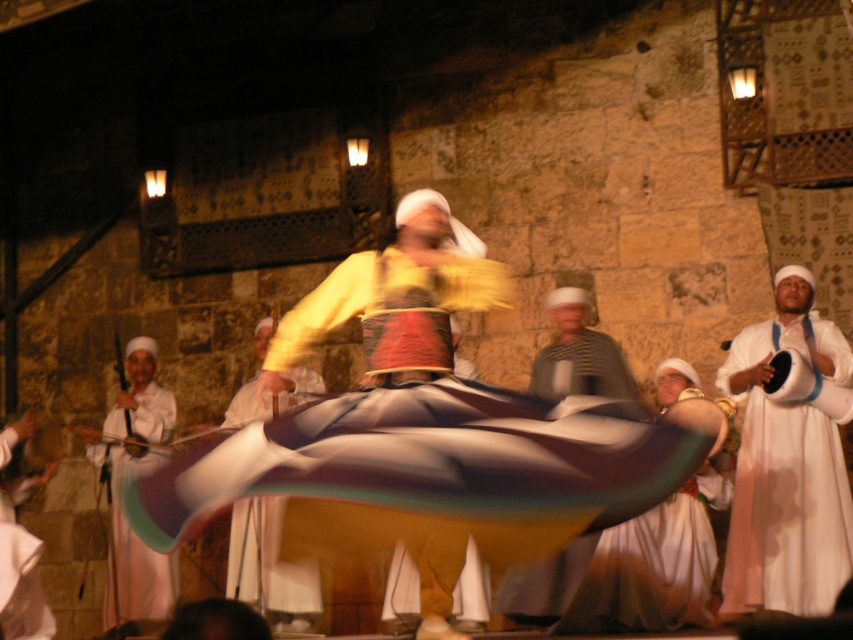
Does white cotton dress at center appear on the left side of striped fabric headscarf at center?

Indeed, white cotton dress at center is positioned on the left side of striped fabric headscarf at center.

Measure the distance from white cotton dress at center to striped fabric headscarf at center.

They are 6.16 meters apart.

Locate an element on the screen. white cotton dress at center is located at coordinates (268, 566).

Does white cotton robe at left have a smaller size compared to white cotton dress at lower left?

Yes.

The image size is (853, 640). What do you see at coordinates (123, 481) in the screenshot? I see `white cotton robe at left` at bounding box center [123, 481].

At what (x,y) coordinates should I click in order to perform the action: click on white cotton robe at left. Please return your answer as a coordinate pair (x, y). The image size is (853, 640). Looking at the image, I should click on (123, 481).

Which is behind, point (766, 579) or point (122, 452)?

Point (122, 452)

Is white cotton robe at right closer to camera compared to white cotton robe at left?

Yes, white cotton robe at right is closer to the viewer.

The height and width of the screenshot is (640, 853). Describe the element at coordinates (786, 467) in the screenshot. I see `white cotton robe at right` at that location.

At what (x,y) coordinates should I click in order to perform the action: click on white cotton robe at right. Please return your answer as a coordinate pair (x, y). Looking at the image, I should click on (786, 467).